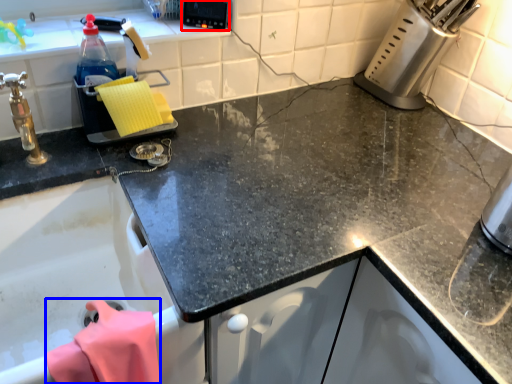
Question: Which of the following is the farthest to the observer, appliance (highlighted by a red box) or clothe (highlighted by a blue box)?

Choices:
 (A) appliance
 (B) clothe

Answer: (A)